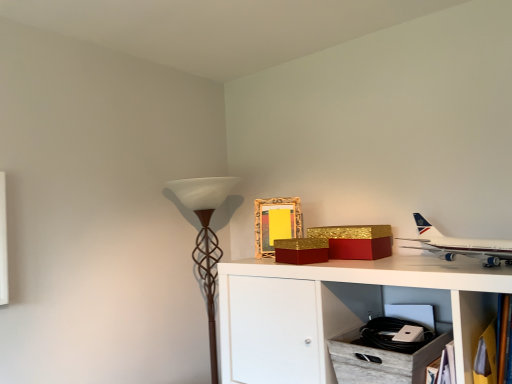
Question: Is gold glittery box at upper center, which ranks as the 1th box in left-to-right order, to the left of gold textured picture frame at upper center from the viewer's perspective?

Choices:
 (A) yes
 (B) no

Answer: (B)

Question: Is gold glittery box at upper center, the second box viewed from the right, touching gold textured picture frame at upper center?

Choices:
 (A) yes
 (B) no

Answer: (B)

Question: From the image's perspective, does gold glittery box at upper center, the second box viewed from the right, appear lower than gold textured picture frame at upper center?

Choices:
 (A) no
 (B) yes

Answer: (B)

Question: Is gold glittery box at upper center, the second box viewed from the right, positioned with its back to gold textured picture frame at upper center?

Choices:
 (A) no
 (B) yes

Answer: (A)

Question: Considering the relative positions of gold glittery box at upper center, the second box viewed from the right, and gold textured picture frame at upper center in the image provided, is gold glittery box at upper center, the second box viewed from the right, to the right of gold textured picture frame at upper center from the viewer's perspective?

Choices:
 (A) yes
 (B) no

Answer: (A)

Question: Can you confirm if gold glittery box at upper center, which ranks as the 1th box in left-to-right order, is taller than gold textured picture frame at upper center?

Choices:
 (A) yes
 (B) no

Answer: (B)

Question: Considering the relative sizes of brown textured floor lamp at left and white glossy airplane at upper right in the image provided, is brown textured floor lamp at left smaller than white glossy airplane at upper right?

Choices:
 (A) no
 (B) yes

Answer: (A)

Question: Does brown textured floor lamp at left lie behind white glossy airplane at upper right?

Choices:
 (A) no
 (B) yes

Answer: (B)

Question: Are brown textured floor lamp at left and white glossy airplane at upper right located far from each other?

Choices:
 (A) no
 (B) yes

Answer: (A)

Question: Is brown textured floor lamp at left facing towards white glossy airplane at upper right?

Choices:
 (A) yes
 (B) no

Answer: (B)

Question: From a real-world perspective, is brown textured floor lamp at left located higher than white glossy airplane at upper right?

Choices:
 (A) no
 (B) yes

Answer: (A)

Question: Does brown textured floor lamp at left have a larger size compared to white glossy airplane at upper right?

Choices:
 (A) yes
 (B) no

Answer: (A)

Question: Can you confirm if gold textured box at upper center, the 2th box in the left-to-right sequence, is bigger than white glossy airplane at upper right?

Choices:
 (A) no
 (B) yes

Answer: (A)